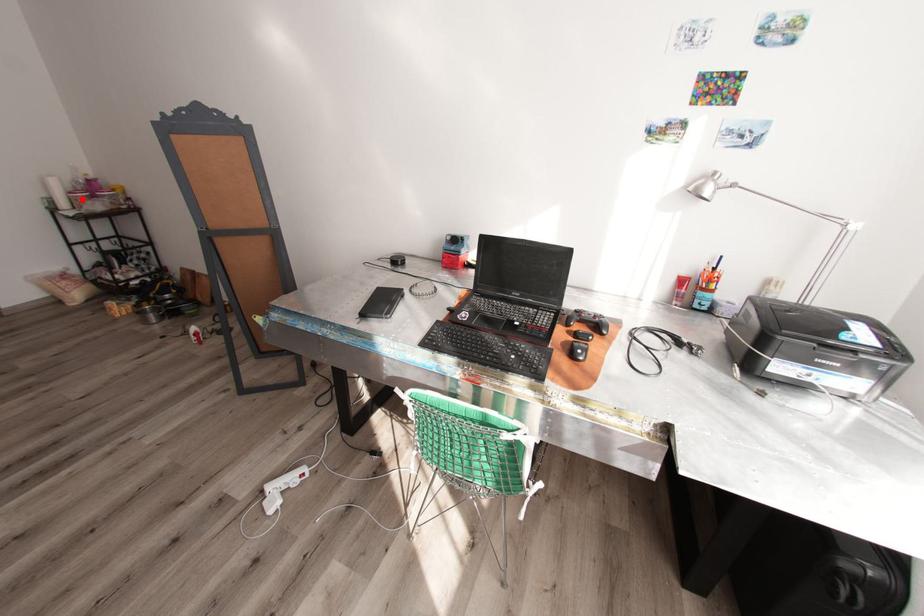
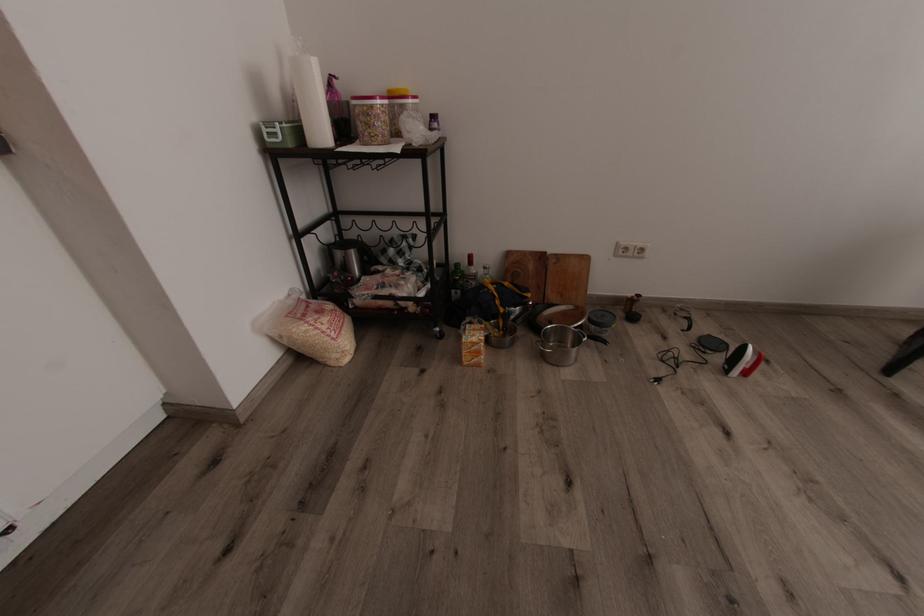
The point at the highlighted location is marked in the first image. Where is the corresponding point in the second image?

(382, 116)